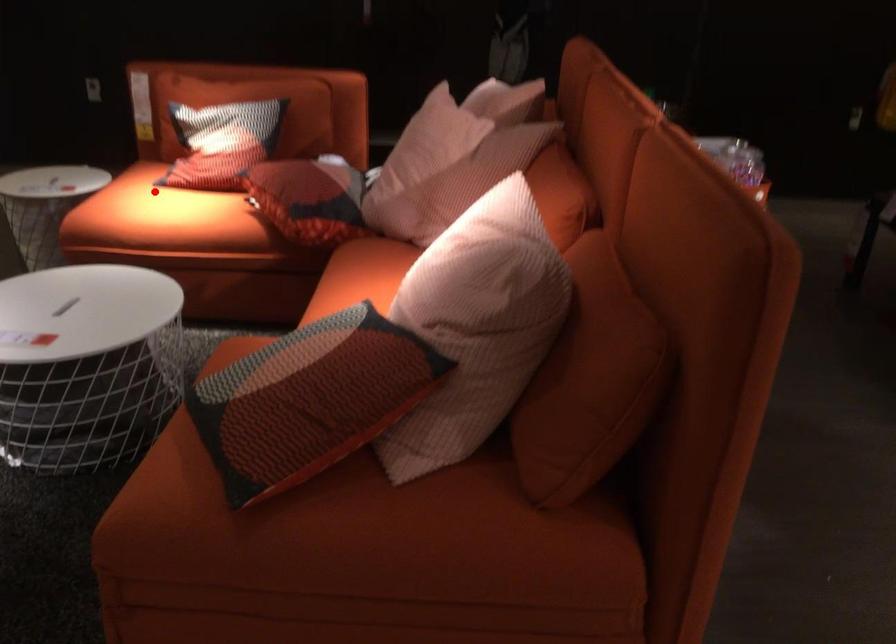
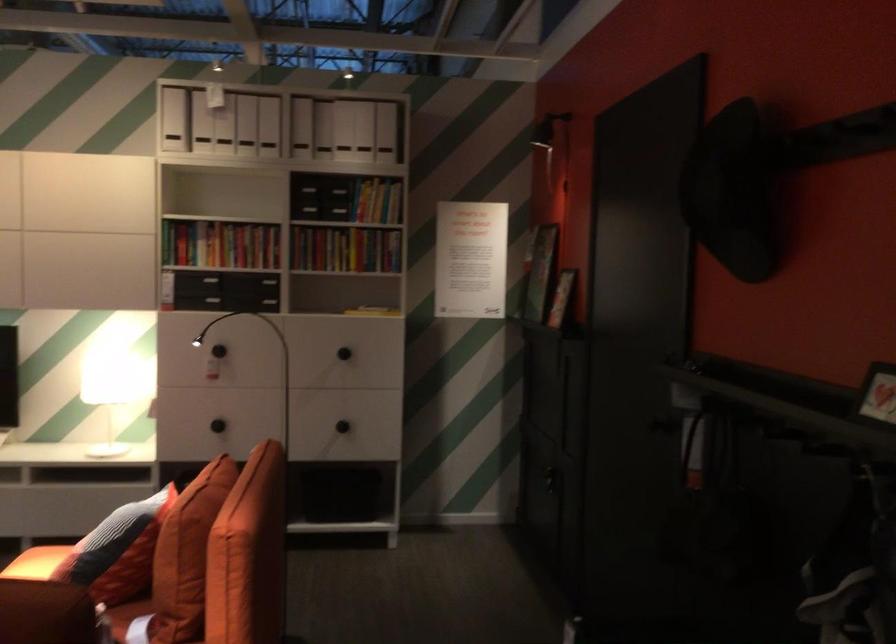
Locate, in the second image, the point that corresponds to the highlighted location in the first image.

(36, 563)